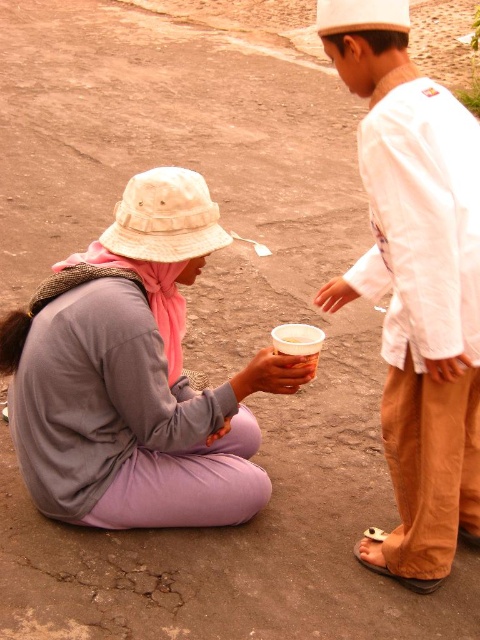
Is purple fabric at lower left further to camera compared to white cotton shirt at right?

A: Yes.

In the scene shown: Does purple fabric at lower left have a larger size compared to white cotton shirt at right?

Incorrect, purple fabric at lower left is not larger than white cotton shirt at right.

Does point (57, 333) come closer to viewer compared to point (368, 144)?

No, it is behind (368, 144).

Identify the location of purple fabric at lower left. coord(136,378).

Who is higher up, white cotton shirt at right or white plastic cup at center?

white cotton shirt at right is above.

Identify the location of white cotton shirt at right. (416, 284).

Which is in front, point (352, 51) or point (308, 360)?

Point (352, 51)

Where is `white cotton shirt at right`? white cotton shirt at right is located at coordinates (416, 284).

Is purple fabric at lower left wider than white plastic cup at center?

Indeed, purple fabric at lower left has a greater width compared to white plastic cup at center.

Consider the image. Who is positioned more to the left, purple fabric at lower left or white plastic cup at center?

purple fabric at lower left is more to the left.

Is point (106, 362) positioned behind point (310, 378)?

That is False.

In order to click on purple fabric at lower left in this screenshot , I will do `click(136, 378)`.